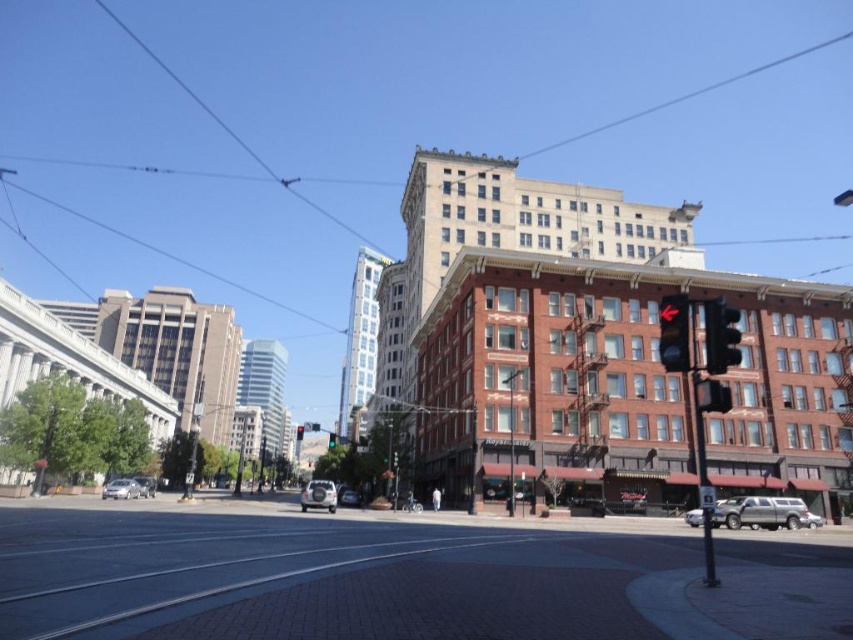
Describe the element at coordinates (398, 580) in the screenshot. This screenshot has width=853, height=640. I see `brick pavement at center` at that location.

Is point (315, 536) farther from camera compared to point (670, 305)?

Yes, point (315, 536) is farther from viewer.

At what (x,y) coordinates should I click in order to perform the action: click on brick pavement at center. Please return your answer as a coordinate pair (x, y). Looking at the image, I should click on (398, 580).

Between point (315, 506) and point (300, 438), which one is positioned in front?

Point (315, 506)

Between point (331, 504) and point (300, 440), which one is positioned behind?

The point (300, 440) is more distant.

Does point (320, 497) lie in front of point (302, 428)?

Yes, point (320, 497) is in front of point (302, 428).

This screenshot has height=640, width=853. What are the coordinates of `silver metallic car at center` in the screenshot? It's located at (318, 496).

Is point (718, 332) positioned behind point (300, 440)?

No.

Is metallic traffic light at center right behind black glass traffic light at upper center?

That is False.

Where is `metallic traffic light at center right`? metallic traffic light at center right is located at coordinates (720, 337).